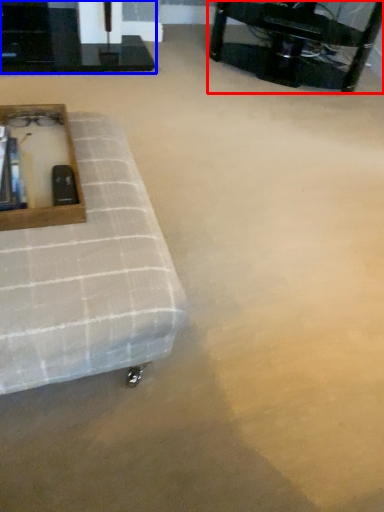
Question: Which point is further to the camera, table (highlighted by a red box) or table (highlighted by a blue box)?

Choices:
 (A) table
 (B) table

Answer: (B)